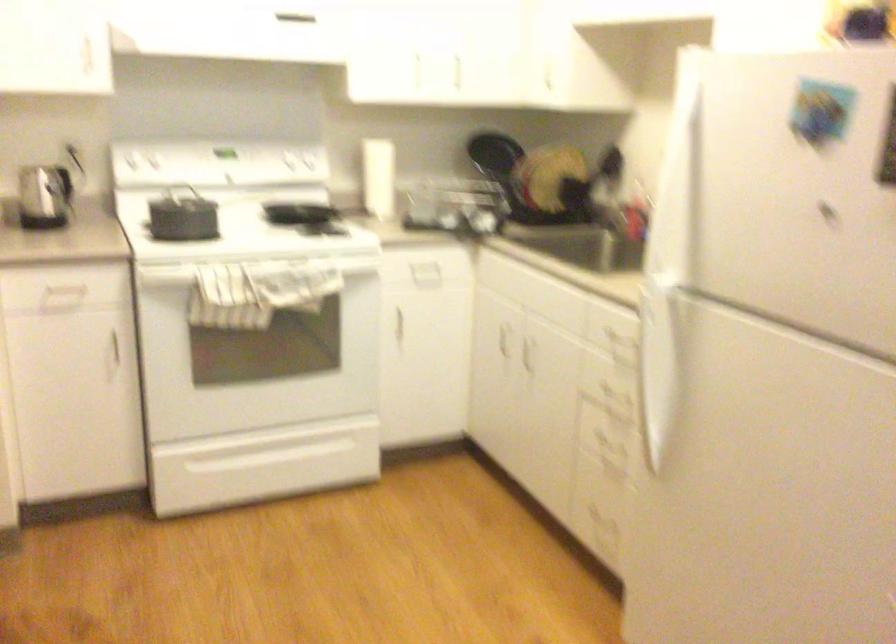
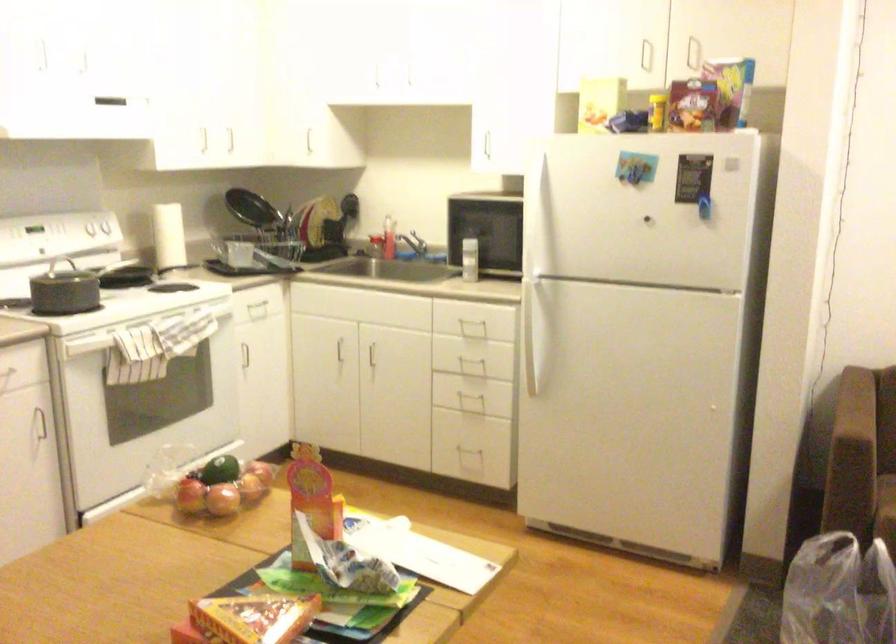
Locate, in the second image, the point that corresponds to point (649, 404) in the first image.

(536, 350)